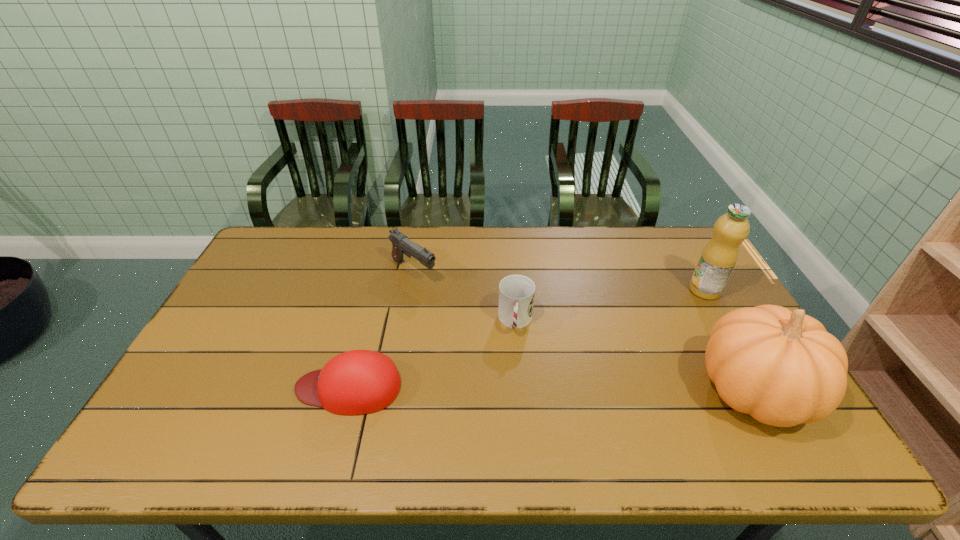
Image resolution: width=960 pixels, height=540 pixels. Identify the location of baseball cap that is at the near edge. (356, 382).

Identify the location of pumpkin that is at the near edge. (782, 367).

At what (x,y) coordinates should I click in order to perform the action: click on pumpkin situated at the right edge. Please return your answer as a coordinate pair (x, y). The image size is (960, 540). Looking at the image, I should click on [782, 367].

At what (x,y) coordinates should I click in order to perform the action: click on fruit juice at the right edge. Please return your answer as a coordinate pair (x, y). Looking at the image, I should click on (718, 259).

In order to click on object at the near right corner in this screenshot , I will do `click(782, 367)`.

This screenshot has width=960, height=540. I want to click on vacant space at the far edge of the desktop, so click(x=618, y=232).

Locate an element on the screen. Image resolution: width=960 pixels, height=540 pixels. free space at the left edge of the desktop is located at coordinates (187, 363).

Where is `free region at the right edge of the desktop`? free region at the right edge of the desktop is located at coordinates (687, 270).

Where is `free space at the far left corner of the desktop`? free space at the far left corner of the desktop is located at coordinates (297, 259).

Identify the location of free region at the far right corner of the desktop. (670, 265).